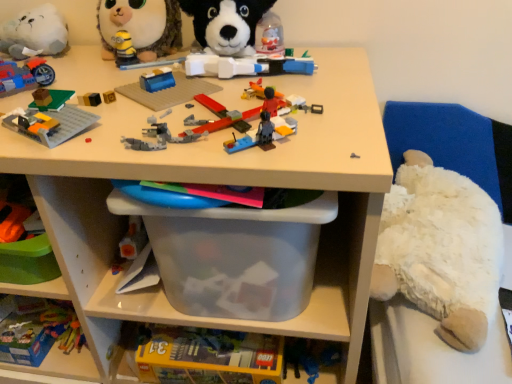
The height and width of the screenshot is (384, 512). I want to click on free space in front of fluffy plush toy at upper left, the fifth toy positioned from the left, so click(129, 82).